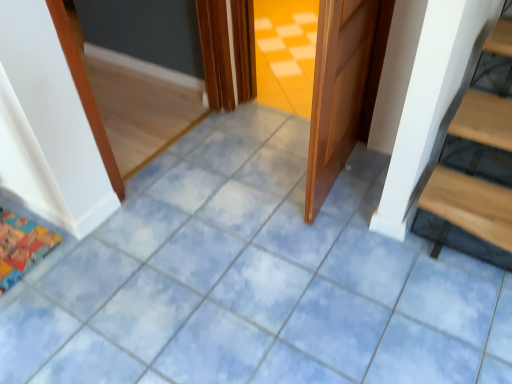
Identify the location of vacant space to the right of cartoon fabric mat at lower left. tap(97, 256).